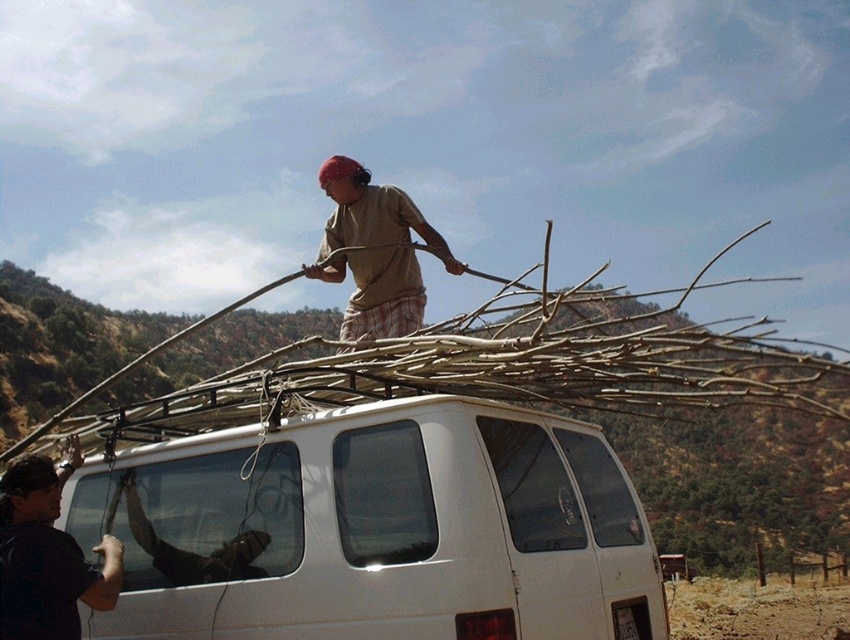
Between brown dry wood at upper center and black fabric at left, which one appears on the left side from the viewer's perspective?

Positioned to the left is black fabric at left.

Locate an element on the screen. brown dry wood at upper center is located at coordinates (483, 365).

Who is more distant from viewer, [578,394] or [63,580]?

The point [578,394] is behind.

Where is `brown dry wood at upper center`? The width and height of the screenshot is (850, 640). brown dry wood at upper center is located at coordinates pos(483,365).

Who is positioned more to the right, black fabric at left or brown cotton shirt at center?

From the viewer's perspective, brown cotton shirt at center appears more on the right side.

Does black fabric at left come in front of brown cotton shirt at center?

That is True.

Does point (100, 576) lie behind point (406, 317)?

No, (100, 576) is in front of (406, 317).

Locate an element on the screen. black fabric at left is located at coordinates (47, 554).

Does white matte van at center have a greater width compared to black fabric at left?

Yes.

Between white matte van at center and black fabric at left, which one has less height?

black fabric at left is shorter.

Locate an element on the screen. The width and height of the screenshot is (850, 640). white matte van at center is located at coordinates (374, 529).